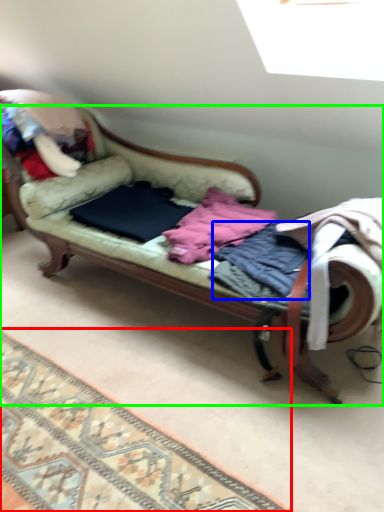
Question: Based on their relative distances, which object is farther from mat (highlighted by a red box)? Choose from clothing (highlighted by a blue box) and studio couch (highlighted by a green box).

Choices:
 (A) clothing
 (B) studio couch

Answer: (A)